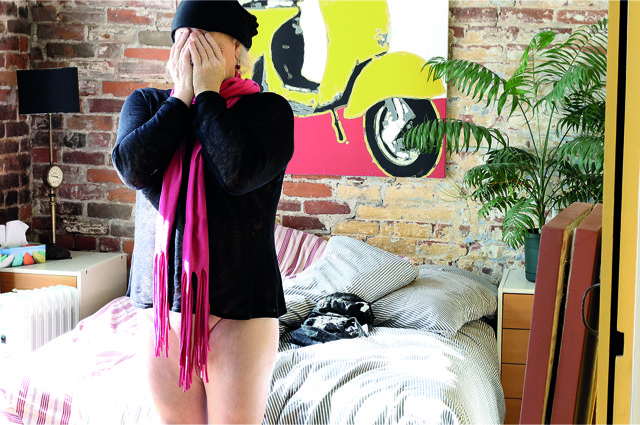
Locate an element on the screen. tissue box is located at coordinates (27, 255).